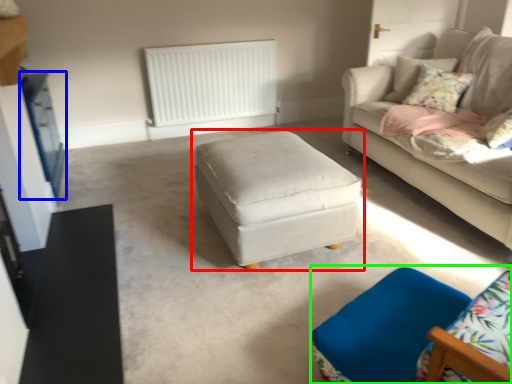
Question: Which is nearer to the table (highlighted by a red box)? dresser (highlighted by a blue box) or swivel chair (highlighted by a green box).

Choices:
 (A) dresser
 (B) swivel chair

Answer: (B)